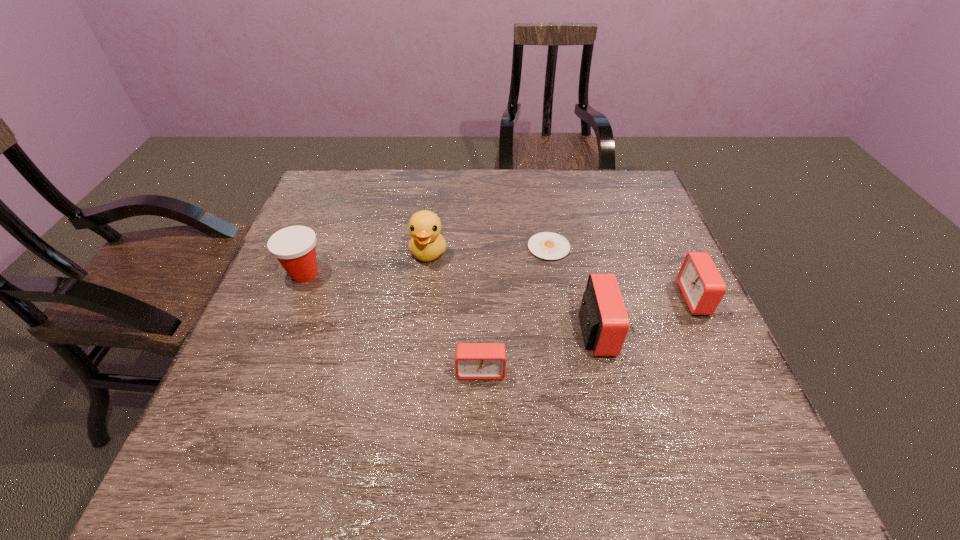
Where is `the fourth object from right to left`? the fourth object from right to left is located at coordinates (473, 361).

Find the location of a particular element. the nearest alarm clock is located at coordinates (473, 361).

I want to click on the tallest alarm clock, so click(x=604, y=321).

This screenshot has width=960, height=540. Find the location of `the rightmost alarm clock`. the rightmost alarm clock is located at coordinates (702, 286).

Where is `the second tallest alarm clock`? This screenshot has height=540, width=960. the second tallest alarm clock is located at coordinates (702, 286).

Find the location of `the fifth object from right to left`. the fifth object from right to left is located at coordinates (427, 244).

The height and width of the screenshot is (540, 960). Identify the location of egg yolk. (546, 245).

You are a GUI agent. You are given a task and a screenshot of the screen. Output one action in this format:
    pyautogui.click(x=<x>, y=<y>)
    Task: Click on the leftmost object
    The height and width of the screenshot is (540, 960).
    Given the screenshot: What is the action you would take?
    pyautogui.click(x=294, y=247)

Identify the location of free space located 0.060m on the front-facing side of the leftmost alarm clock. 481,408.

The width and height of the screenshot is (960, 540). Identify the location of vacant space located 0.120m on the front-facing side of the tallest alarm clock. (665, 332).